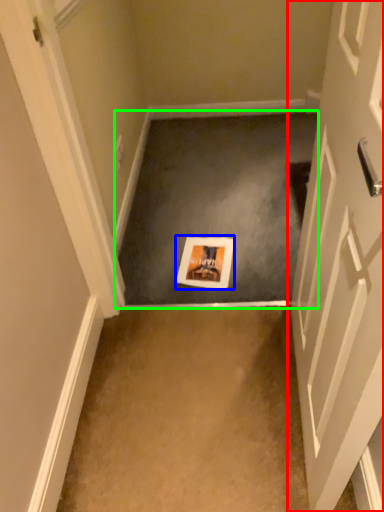
Question: Which is nearer to the door (highlighted by a red box)? postcard (highlighted by a blue box) or concrete (highlighted by a green box).

Choices:
 (A) postcard
 (B) concrete

Answer: (A)